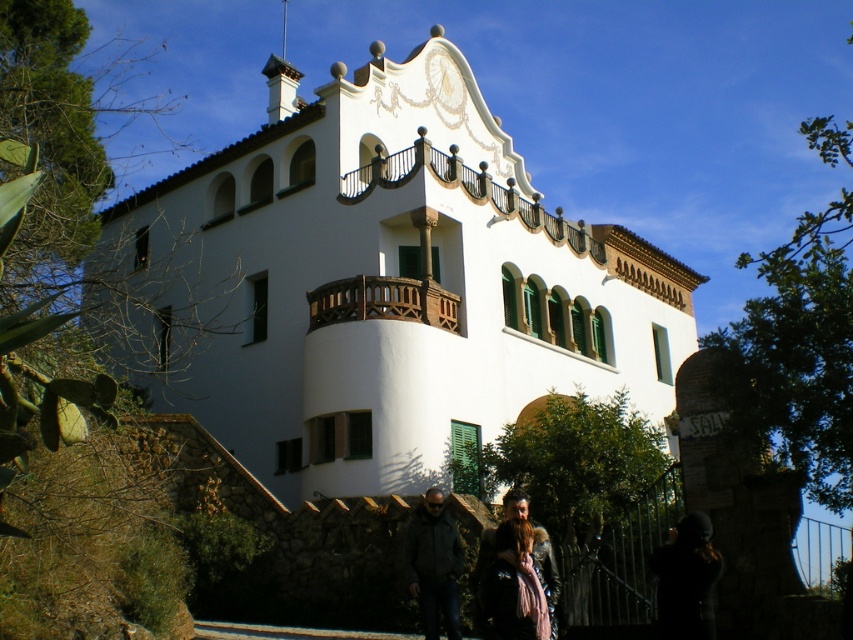
You are standing on the paved path and want to greet the person wearing the dark gray jacket at center. Which direction should you walk to approach them from the leather jacket at lower center?

The dark gray jacket at center is to the left of the leather jacket at lower center, so you should walk to the left to approach them from the leather jacket at lower center.

You are a photographer standing on the path near the leather jacket at lower center. You want to capture the white stucco building at center in your shot. Since the building is larger than the jacket, how should you adjust your camera angle to include both the building and the jacket in the frame?

Since the white stucco building at center is bigger than the leather jacket at lower center, you should position yourself closer to the leather jacket at lower center to ensure both objects are visible in the frame without the building overwhelming the jacket.

You are standing in front of the Mediterranean style building and notice two jackets. The first is a dark gray jacket at center and the second is a leather jacket at lower center. Which jacket appears shorter?

The dark gray jacket at center has a lesser height compared to the leather jacket at lower center, so the dark gray jacket at center appears shorter.